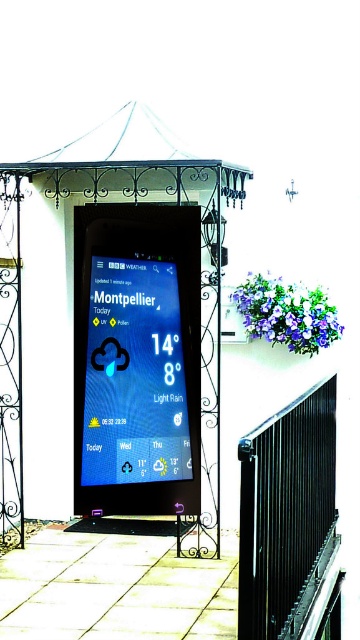
You are a maintenance worker needing to reach both the matte blue screen at center and the black wrought iron canopy at upper center for cleaning. Your ladder can extend up to 1.2 meters. Can you safely clean both objects with the ladder without moving it?

The matte blue screen at center and the black wrought iron canopy at upper center are 1.16 meters apart. Since the ladder can extend up to 1.2 meters, you can safely clean both objects without moving the ladder as the distance between them is within the ladder length.